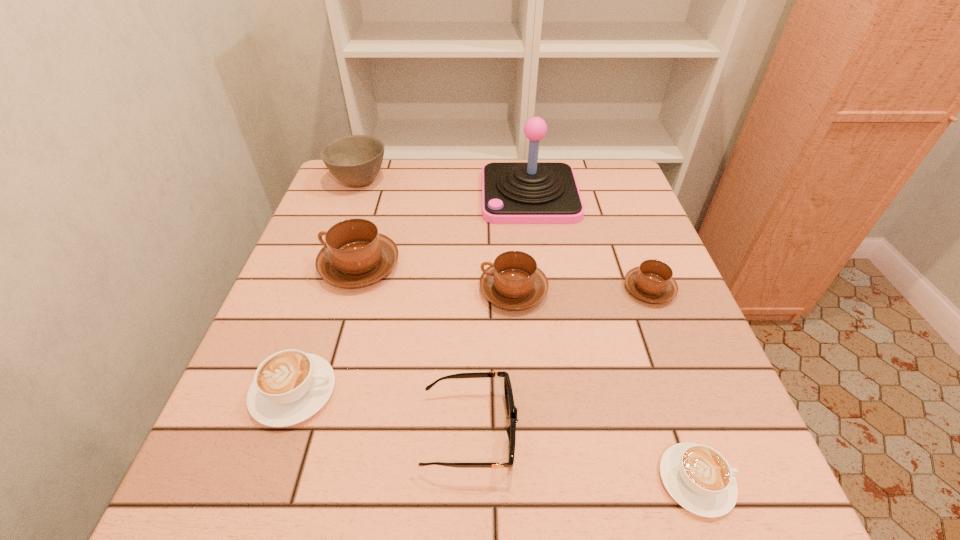
Where is `free space located 0.220m on the side of the third cappuccino from right to left with the handle`? Image resolution: width=960 pixels, height=540 pixels. free space located 0.220m on the side of the third cappuccino from right to left with the handle is located at coordinates point(376,291).

Find the location of `vacant space located 0.150m on the side of the farther white cappuccino with the handle`. vacant space located 0.150m on the side of the farther white cappuccino with the handle is located at coordinates (422, 392).

In order to click on vacant space located on the side of the smallest brown cappuccino with the handle in this screenshot , I will do `click(613, 196)`.

Where is `free location located 0.360m on the side of the smallest brown cappuccino with the handle`? This screenshot has height=540, width=960. free location located 0.360m on the side of the smallest brown cappuccino with the handle is located at coordinates (609, 184).

This screenshot has width=960, height=540. I want to click on free space located on the side of the smallest brown cappuccino with the handle, so click(x=609, y=184).

Where is `vacant space located on the front-facing side of the sunglasses`? This screenshot has height=540, width=960. vacant space located on the front-facing side of the sunglasses is located at coordinates (578, 431).

Identify the location of joystick that is at the far edge. (532, 192).

Where is `bowl that is at the far edge`? Image resolution: width=960 pixels, height=540 pixels. bowl that is at the far edge is located at coordinates (355, 160).

You are a GUI agent. You are given a task and a screenshot of the screen. Output one action in this format:
    pyautogui.click(x=<x>, y=<y>)
    Task: Click on the sunglasses at the near edge
    Image resolution: width=960 pixels, height=540 pixels.
    Given the screenshot: What is the action you would take?
    pyautogui.click(x=511, y=409)

Image resolution: width=960 pixels, height=540 pixels. I want to click on cappuccino at the near edge, so click(x=699, y=478).